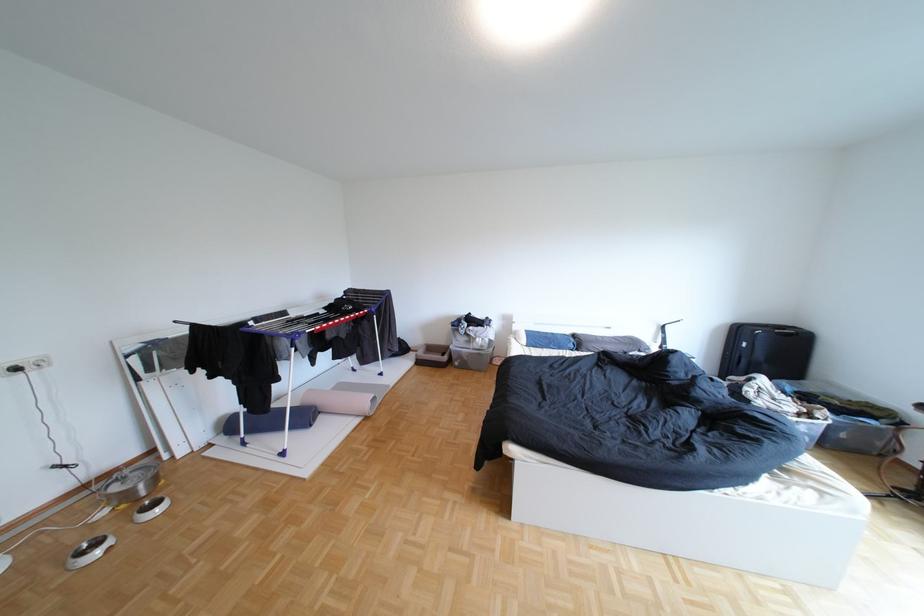
The image size is (924, 616). Find the location of `grey pillow`. grey pillow is located at coordinates (610, 342).